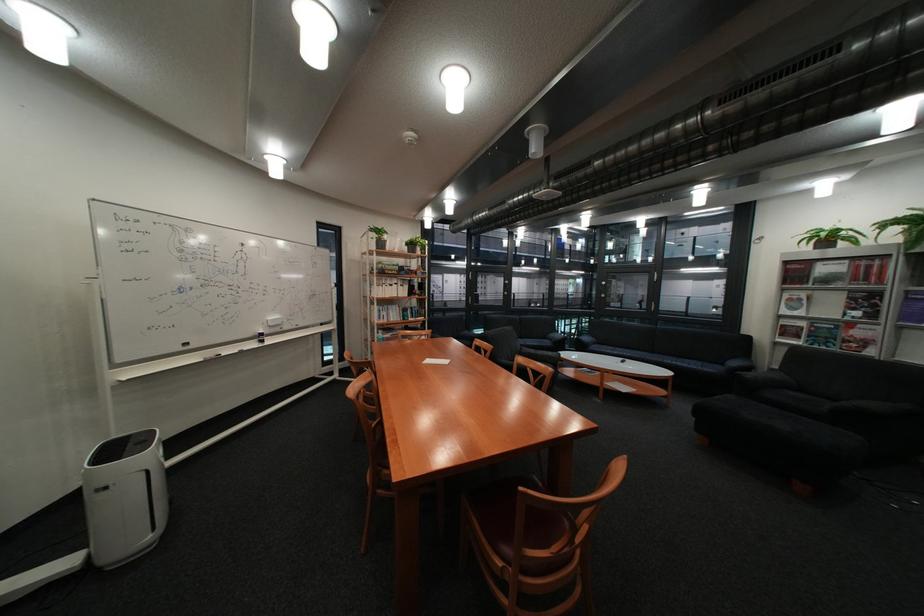
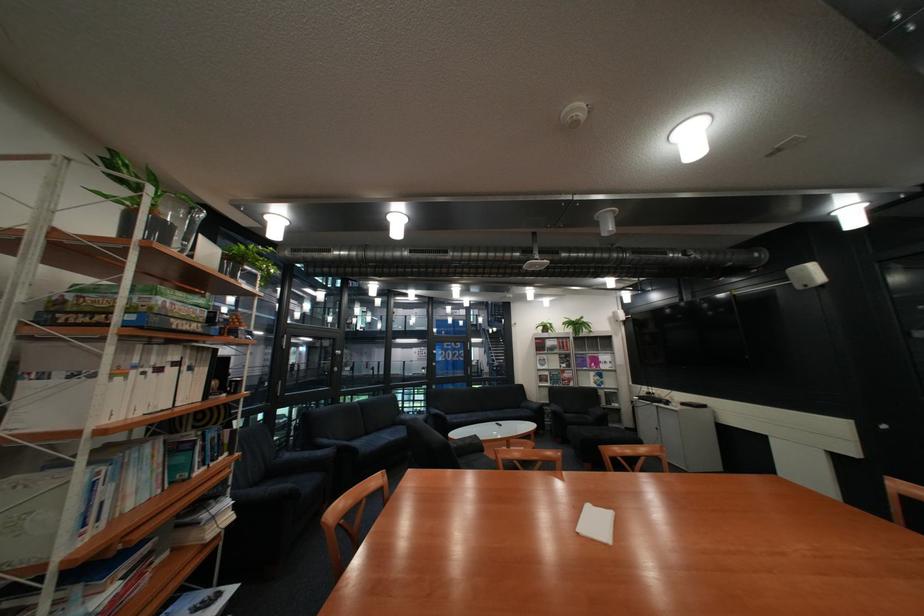
Locate, in the second image, the point that corresponds to the point at 392,270 in the first image.

(141, 312)